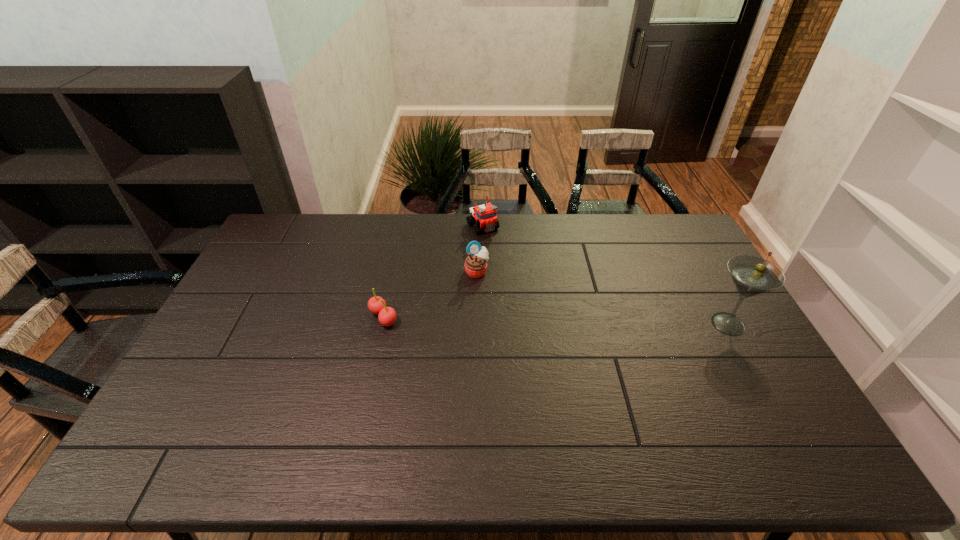
Locate an element on the screen. vacant space at the far left corner of the desktop is located at coordinates (293, 239).

The image size is (960, 540). Find the location of `free space at the far right corner of the desktop`. free space at the far right corner of the desktop is located at coordinates (655, 227).

What are the coordinates of `free space at the near right corner` in the screenshot? It's located at coord(732,402).

Image resolution: width=960 pixels, height=540 pixels. Identify the location of vacant space that is in between the third nearest object and the cherry. (430, 294).

This screenshot has height=540, width=960. Find the location of `empty space that is in between the Lego and the shortest object`. empty space that is in between the Lego and the shortest object is located at coordinates (433, 272).

The width and height of the screenshot is (960, 540). Identify the location of vacant area that lies between the rightmost object and the farthest object. (606, 275).

Find the location of `free space between the shortest object and the tallest object`. free space between the shortest object and the tallest object is located at coordinates (556, 321).

I want to click on free space between the second farthest object and the rightmost object, so click(603, 298).

Find the location of a particular element. The width and height of the screenshot is (960, 540). vacant area that lies between the cherry and the tallest object is located at coordinates (556, 321).

In order to click on free space between the third nearest object and the rightmost object in this screenshot , I will do `click(603, 298)`.